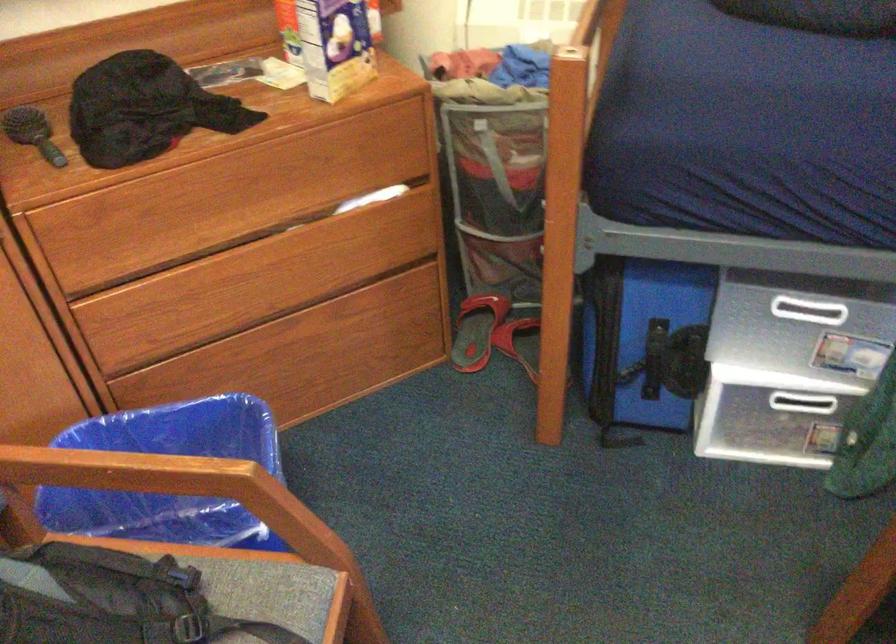
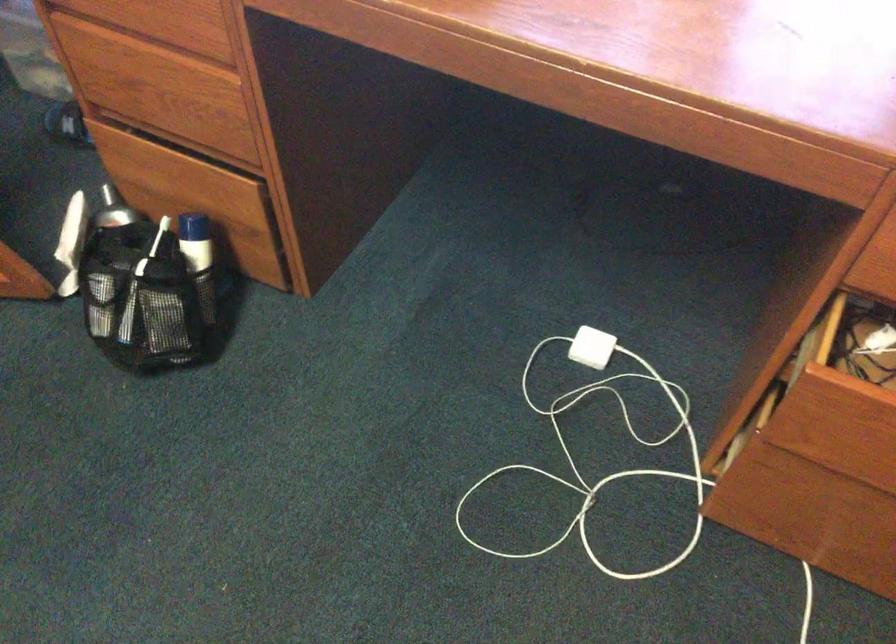
How did the camera likely rotate?

The rotation direction of the camera is right-down.